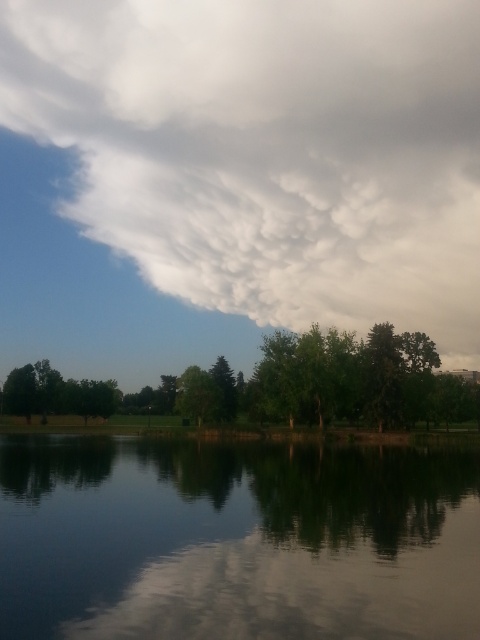
You are standing in the serene outdoor scene and want to take a photo of both the smooth reflective water at center and the green leafy tree at center. Which object will appear larger in your photo if you focus on the water?

The smooth reflective water at center will appear larger in the photo because it is closer to the viewer than the green leafy tree at center.

You are an artist trying to paint the scene. You want to ensure the white fluffy cloud at upper center and the smooth reflective water at center are proportionally accurate. Which object should you paint to be taller?

The white fluffy cloud at upper center should be painted taller than the smooth reflective water at center because it is taller according to the description.